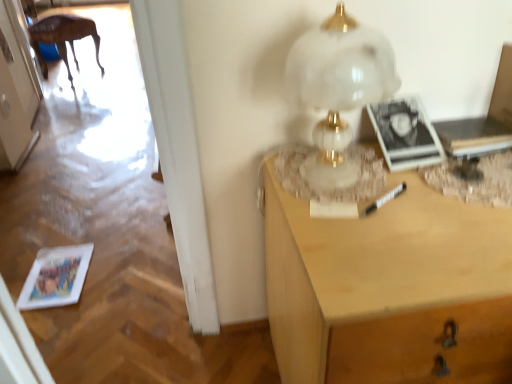
The height and width of the screenshot is (384, 512). I want to click on free spot to the right of matte paper magazine at lower left, so click(x=116, y=271).